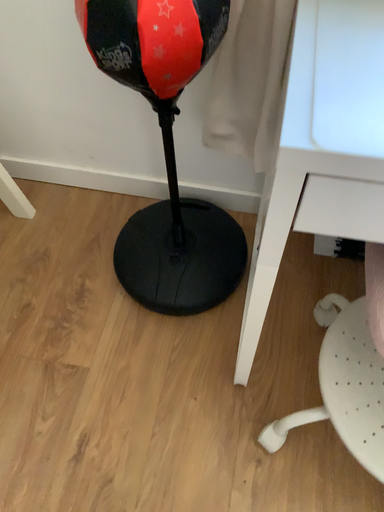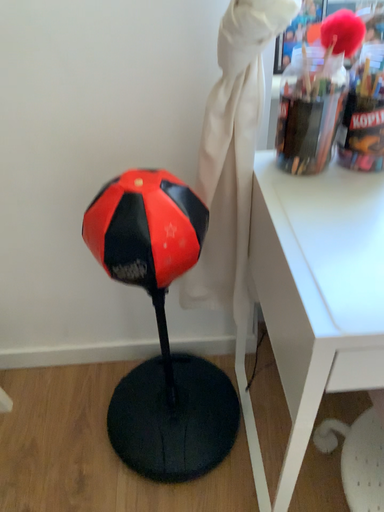
Question: Which way did the camera rotate in the video?

Choices:
 (A) rotated right
 (B) rotated left

Answer: (A)